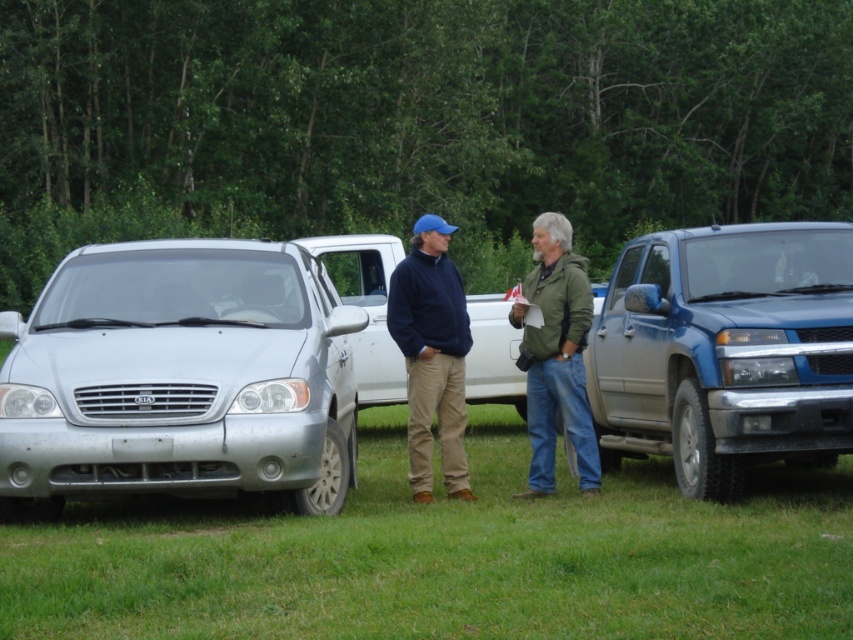
You are standing at the camera position and want to reach the point at the bottom of the image first. Which point should you move towards, point (109, 388) or point (846, 308)?

Point (109, 388) is closer to the camera than point (846, 308), so you should move towards point (109, 388) to reach the bottom of the image first.

You are standing at point 0.5, 0.2. You want to walk to the silver metallic van at center. Which direction should you go?

The silver metallic van at center is located at point (178,378). Since you are at (170,320), you should move northeast to reach it.